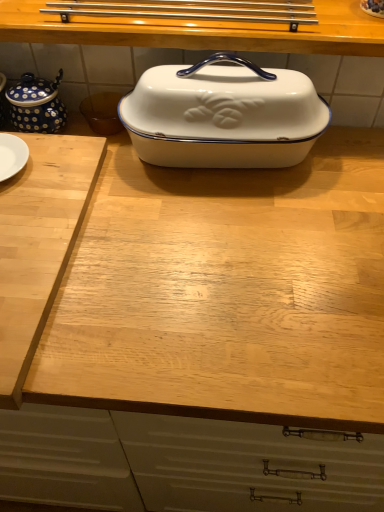
Question: In terms of height, does white enamel casserole dish at center look taller or shorter compared to blue dotted ceramic tea pot at left?

Choices:
 (A) tall
 (B) short

Answer: (A)

Question: Is white enamel casserole dish at center bigger or smaller than blue dotted ceramic tea pot at left?

Choices:
 (A) small
 (B) big

Answer: (B)

Question: Estimate the real-world distances between objects in this image. Which object is farther from the light wood cutting board at left?

Choices:
 (A) blue polka dot ceramic jar at upper left
 (B) white enamel casserole dish at center
 (C) white glossy enamel dish at center
 (D) blue dotted ceramic tea pot at left

Answer: (A)

Question: Which of these objects is positioned closest to the white enamel casserole dish at center?

Choices:
 (A) blue dotted ceramic tea pot at left
 (B) light wood cutting board at left
 (C) blue polka dot ceramic jar at upper left
 (D) white glossy enamel dish at center

Answer: (D)